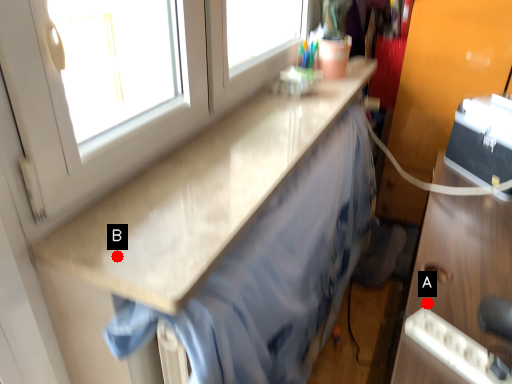
Question: Two points are circled on the image, labeled by A and B beside each circle. Which point appears farthest from the camera in this image?

Choices:
 (A) A is further
 (B) B is further

Answer: (A)